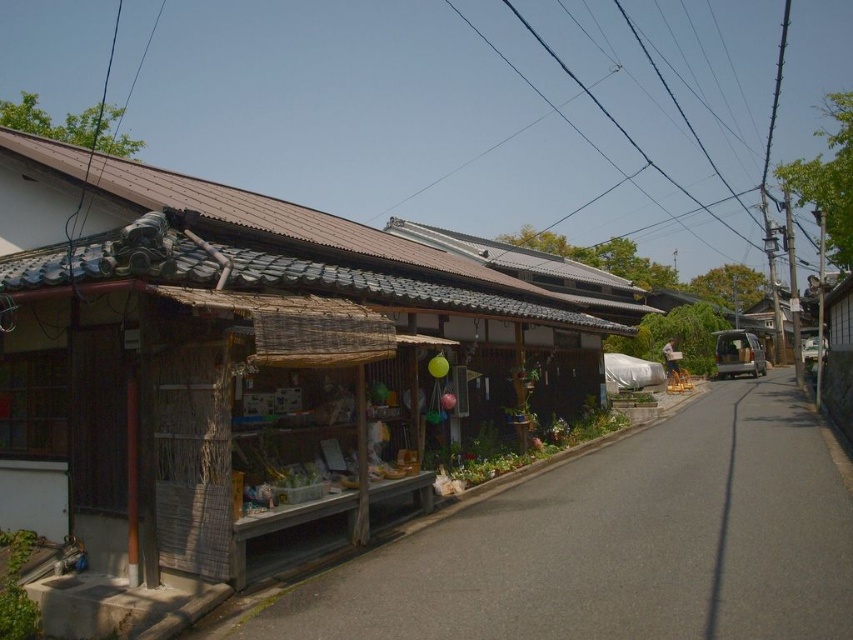
Question: Is the position of wooden hut at center less distant than that of black wire at upper center?

Choices:
 (A) yes
 (B) no

Answer: (A)

Question: Where is wooden stall at lower left located in relation to black wire at upper center in the image?

Choices:
 (A) below
 (B) above

Answer: (A)

Question: Which object appears farthest from the camera in this image?

Choices:
 (A) wooden stall at lower left
 (B) wooden hut at center
 (C) black wire at upper center

Answer: (C)

Question: Which is nearer to the wooden stall at lower left?

Choices:
 (A) wooden hut at center
 (B) black wire at upper center

Answer: (A)

Question: Can you confirm if wooden hut at center is smaller than wooden stall at lower left?

Choices:
 (A) no
 (B) yes

Answer: (A)

Question: Which object appears closest to the camera in this image?

Choices:
 (A) black wire at upper center
 (B) wooden hut at center

Answer: (B)